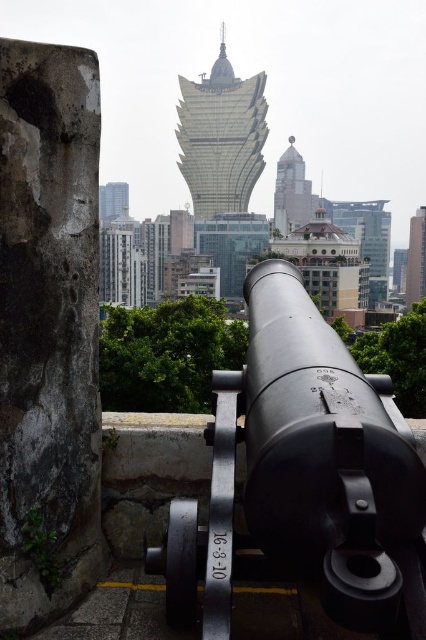
Based on the scene described, which tower is wider, the smooth gray tower at center or the metallic glass tower at right?

The smooth gray tower at center is wider than the metallic glass tower at right according to the description.

You are a drone operator trying to navigate between two points in the image. You must fly from the point at coordinate point [253,150] to the point at coordinate point [290,145]. Based on the scene description, will your drone have to go over or under any obstacles along the flight path?

The point at coordinate point [253,150] is in front of point [290,145]. Since the cannon and stone wall are in the foreground, the drone will have to fly over the cannon and stone wall to reach the second point.

What is the color of the building indicated by the point at coordinates (290, 192)?

The point at coordinates (290, 192) indicates a smooth gray tower at center.